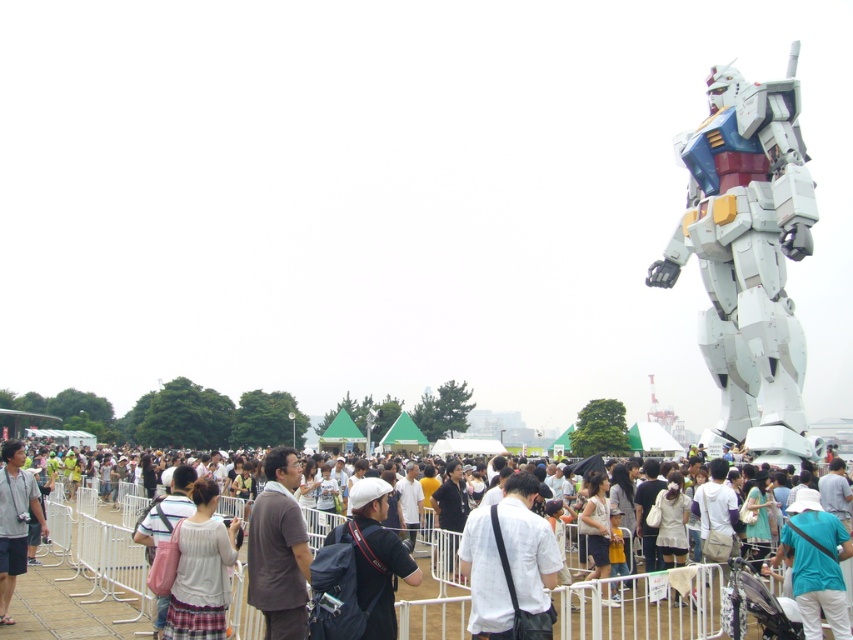
Consider the image. You are a photographer at the event and need to capture both the white metallic robot at upper right and the matte black camera at lower left in a single shot. Based on their positions, which object should you frame first to ensure both are visible in your photo?

The white metallic robot at upper right is to the right of the matte black camera at lower left, so you should frame the matte black camera at lower left first, then adjust to include the robot on the right side of the frame.

You are a photographer standing at the event location. You want to capture a clear photo of the white metallic robot at upper right. Considering your camera can focus on subjects within 80 meters, will the robot be in focus?

The white metallic robot at upper right is 82.99 meters away from the camera, which is slightly beyond the camera focus range of 80 meters. The robot will not be in focus.